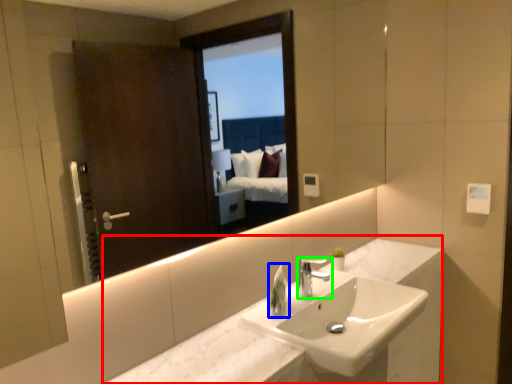
Question: Which object is the closest to the counter (highlighted by a red box)? Choose among these: soap dispenser (highlighted by a blue box) or tap (highlighted by a green box).

Choices:
 (A) soap dispenser
 (B) tap

Answer: (B)